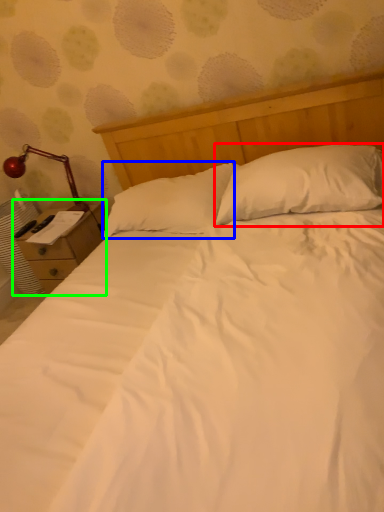
Question: Which is nearer to the pillow (highlighted by a red box)? pillow (highlighted by a blue box) or nightstand (highlighted by a green box).

Choices:
 (A) pillow
 (B) nightstand

Answer: (A)